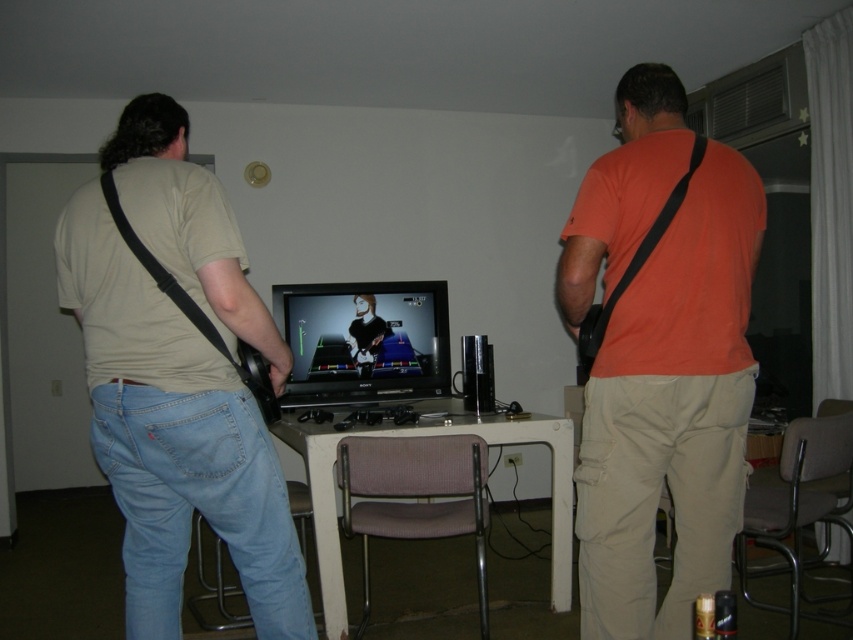
Question: Which point is closer to the camera?

Choices:
 (A) matte beige shirt at left
 (B) orange matte shirt at center
 (C) white plastic table at center

Answer: (A)

Question: Estimate the real-world distances between objects in this image. Which object is closer to the white plastic table at center?

Choices:
 (A) matte beige shirt at left
 (B) orange matte shirt at center

Answer: (B)

Question: Can you confirm if orange matte shirt at center is positioned to the right of white plastic table at center?

Choices:
 (A) no
 (B) yes

Answer: (B)

Question: Can you confirm if orange matte shirt at center is positioned to the left of matte beige shirt at left?

Choices:
 (A) no
 (B) yes

Answer: (A)

Question: Is orange matte shirt at center above matte beige shirt at left?

Choices:
 (A) no
 (B) yes

Answer: (B)

Question: Which of the following is the farthest from the observer?

Choices:
 (A) (635, 416)
 (B) (325, 449)
 (C) (149, 380)

Answer: (B)